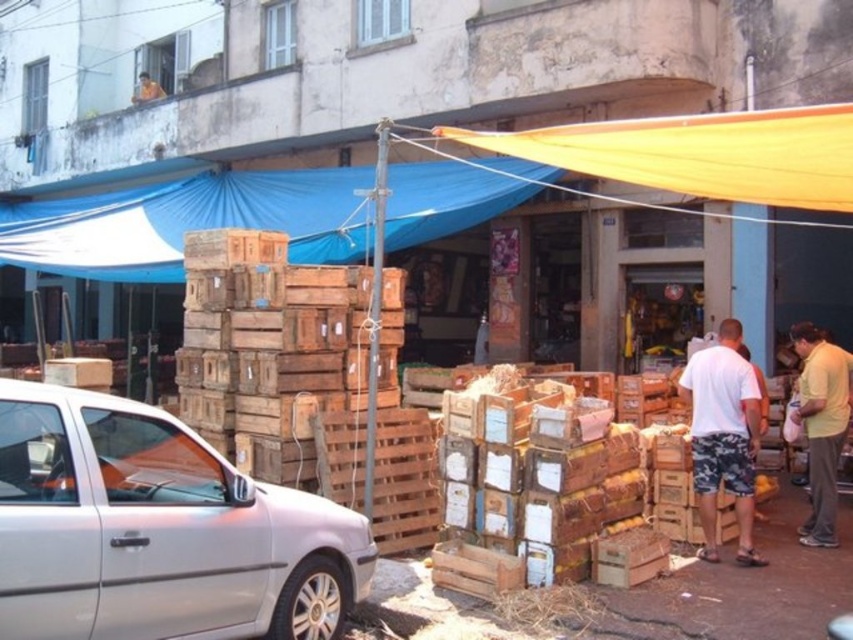
Between white cotton t-shirt at right and yellow cotton shirt at right, which one appears on the left side from the viewer's perspective?

white cotton t-shirt at right is more to the left.

Is point (733, 369) closer to viewer compared to point (817, 516)?

Yes, it is in front of point (817, 516).

This screenshot has height=640, width=853. Identify the location of white cotton t-shirt at right. (723, 435).

This screenshot has width=853, height=640. What do you see at coordinates (157, 531) in the screenshot? I see `silver metallic car at lower left` at bounding box center [157, 531].

How much distance is there between silver metallic car at lower left and yellow cotton shirt at right?

silver metallic car at lower left is 4.98 meters from yellow cotton shirt at right.

This screenshot has width=853, height=640. What are the coordinates of `silver metallic car at lower left` in the screenshot? It's located at (157, 531).

At what (x,y) coordinates should I click in order to perform the action: click on silver metallic car at lower left. Please return your answer as a coordinate pair (x, y). The height and width of the screenshot is (640, 853). Looking at the image, I should click on (157, 531).

Between blue fabric canopy at upper center and white cotton t-shirt at right, which one is positioned lower?

Positioned lower is white cotton t-shirt at right.

Who is higher up, blue fabric canopy at upper center or white cotton t-shirt at right?

Positioned higher is blue fabric canopy at upper center.

Measure the distance between point (326, 248) and camera.

Point (326, 248) is 10.38 meters from camera.

Image resolution: width=853 pixels, height=640 pixels. I want to click on blue fabric canopy at upper center, so click(x=189, y=221).